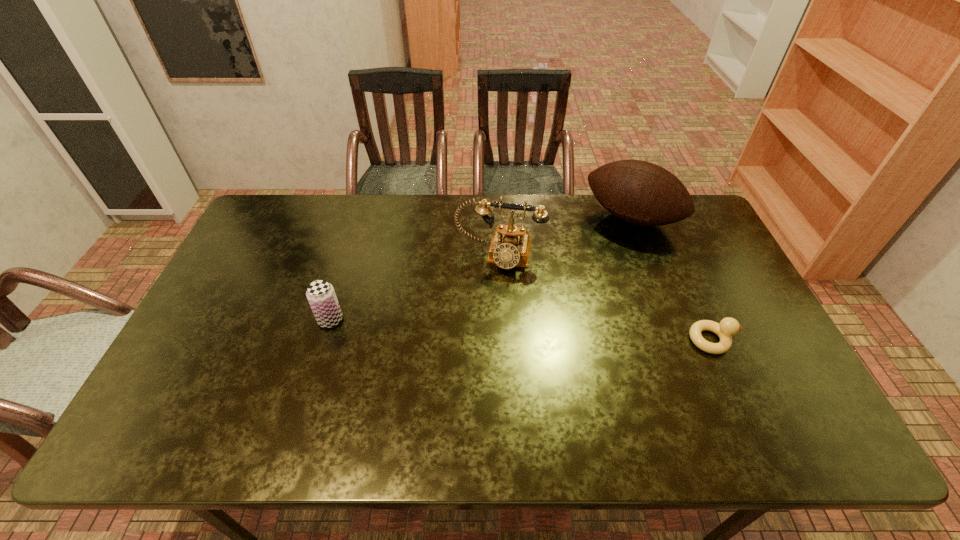
Find the location of `the second shortest object`. the second shortest object is located at coordinates (321, 296).

I want to click on beer can, so click(x=321, y=296).

The image size is (960, 540). Identify the location of duckling. (728, 326).

Locate an element on the screen. The width and height of the screenshot is (960, 540). the second object from left to right is located at coordinates (510, 246).

The height and width of the screenshot is (540, 960). Find the location of `football`. football is located at coordinates (639, 192).

At what (x,y) coordinates should I click in order to perform the action: click on free space located 0.090m on the front of the third tallest object. Please return your answer as a coordinate pair (x, y). The height and width of the screenshot is (540, 960). Looking at the image, I should click on (319, 358).

At what (x,y) coordinates should I click in order to perform the action: click on free location located at the beak of the duckling. Please return your answer as a coordinate pair (x, y). Looking at the image, I should click on (767, 340).

This screenshot has height=540, width=960. What are the coordinates of `free location located 0.080m on the dial number of the telephone` in the screenshot? It's located at (488, 292).

At what (x,y) coordinates should I click in order to perform the action: click on vacant region located 0.140m on the dial number of the telephone. Please return your answer as a coordinate pair (x, y). Looking at the image, I should click on (484, 307).

Find the location of a particular element. The height and width of the screenshot is (540, 960). vacant space located on the dial number of the telephone is located at coordinates [x=483, y=313].